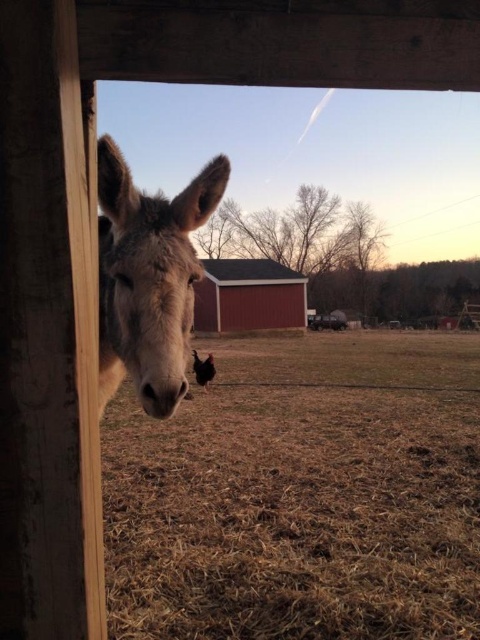
Can you confirm if fuzzy gray mule at left is shorter than red wood barn at center?

Yes, fuzzy gray mule at left is shorter than red wood barn at center.

Between fuzzy gray mule at left and red wood barn at center, which one appears on the right side from the viewer's perspective?

red wood barn at center is more to the right.

Identify the location of fuzzy gray mule at left. (148, 278).